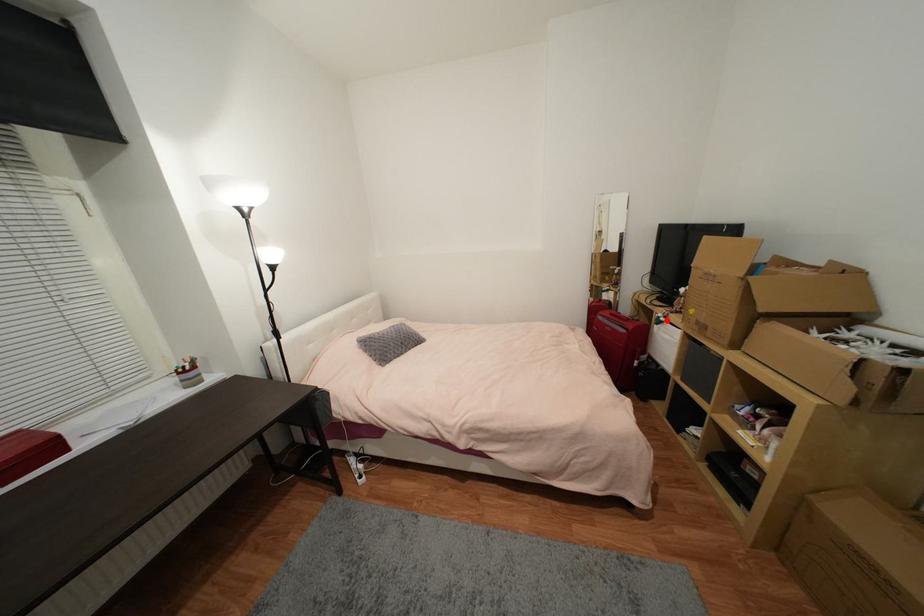
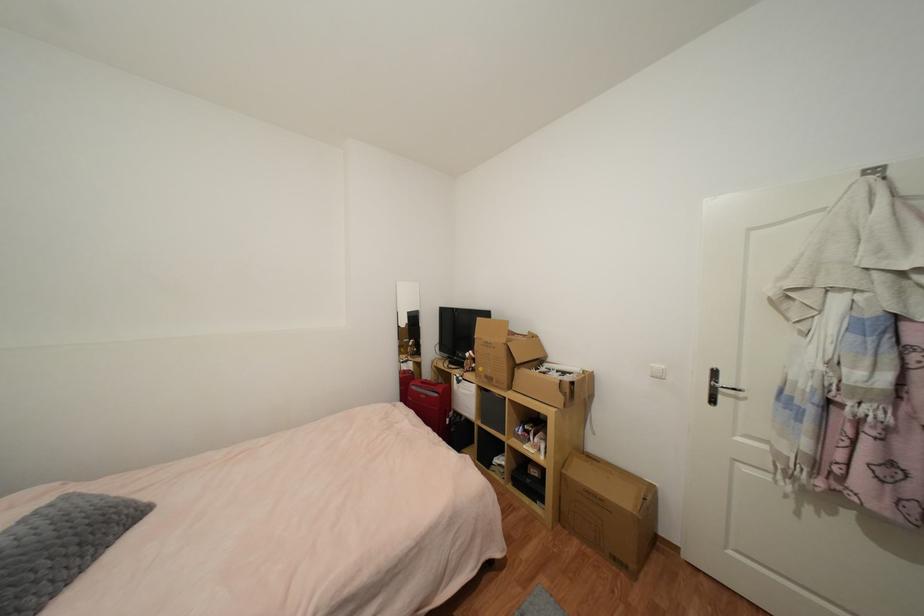
Question: I am providing you with two images of the same scene from different viewpoints. A red point is marked on the first image. Can you still see the location of the red point in image 2?

Choices:
 (A) Yes
 (B) No

Answer: (A)